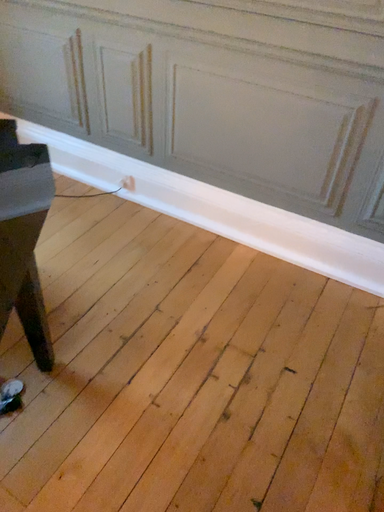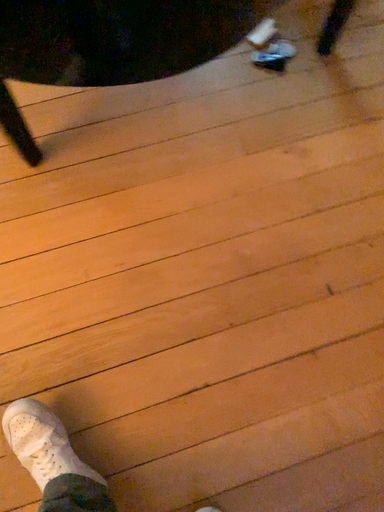
Question: Which way did the camera rotate in the video?

Choices:
 (A) rotated upward
 (B) rotated downward

Answer: (B)